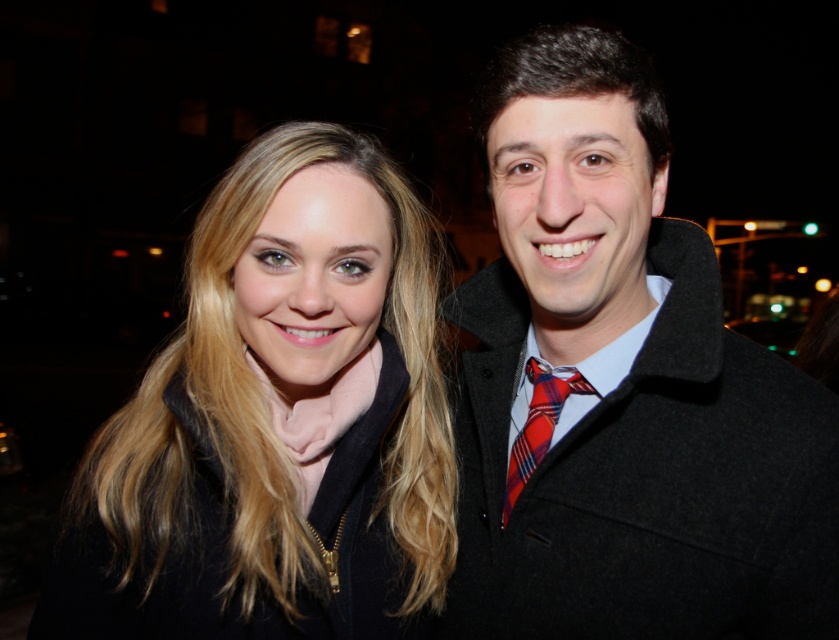
You are a photographer setting up a portrait for the two people in the image. You need to ensure that both the matte black coat at right and the plaid fabric tie at right are clearly visible in the frame. Based on their sizes, will you need to adjust the camera angle to capture both details adequately?

The matte black coat at right might be wider than the plaid fabric tie at right, so adjusting the camera angle may be necessary to ensure both details are visible. Focus on the coat first due to its larger size and then adjust to capture the smaller tie details.

You are a photographer trying to capture a group photo of two people wearing matte black coats. You notice the matte black coat at right and the matte black coat at center in the scene. Given that your camera has a minimum focus distance of 30 centimeters, will you be able to focus on both coats simultaneously?

The matte black coat at right and the matte black coat at center are 28.78 centimeters apart. Since the distance between them is less than the camera minimum focus distance of 30 centimeters, the camera may not be able to focus on both coats simultaneously.

You are a photographer trying to capture a portrait of the two people in the image. You want to ensure that both subjects are in focus. Given their positions at coordinates point (x=488, y=499) and point (x=545, y=444), which subject should you focus on to ensure both are sharp?

You should focus on point (x=545, y=444) because it is closer to the camera than point (x=488, y=499). By focusing on the closer subject, the depth of field will extend backward, increasing the likelihood that both subjects are in focus.